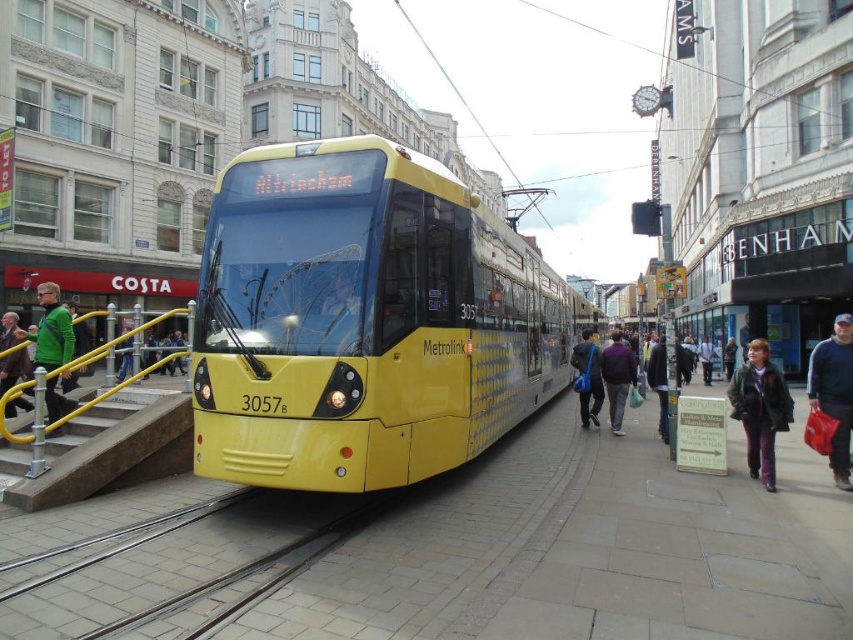
Question: Among these points, which one is nearest to the camera?

Choices:
 (A) (834, 403)
 (B) (576, 360)
 (C) (64, 358)
 (D) (746, 380)

Answer: (A)

Question: Observing the image, what is the correct spatial positioning of dark blue fabric jacket at lower right in reference to green fabric jacket at left?

Choices:
 (A) left
 (B) right

Answer: (B)

Question: Does green fuzzy coat at lower right have a smaller size compared to dark blue fabric jacket at lower right?

Choices:
 (A) no
 (B) yes

Answer: (B)

Question: Which object is farther from the camera taking this photo?

Choices:
 (A) dark blue fabric jacket at lower right
 (B) green fuzzy coat at lower right

Answer: (B)

Question: Which object is closer to the camera taking this photo?

Choices:
 (A) green fuzzy coat at lower right
 (B) dark blue fabric jacket at lower right
 (C) blue fabric bag at center
 (D) green fabric jacket at left

Answer: (D)

Question: Can you confirm if green fuzzy coat at lower right is bigger than green fabric jacket at left?

Choices:
 (A) no
 (B) yes

Answer: (A)